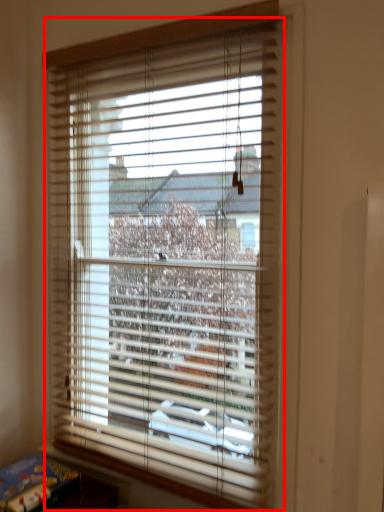
Question: Observing the image, what is the correct spatial positioning of window blind (annotated by the red box) in reference to paperback book?

Choices:
 (A) right
 (B) left

Answer: (A)